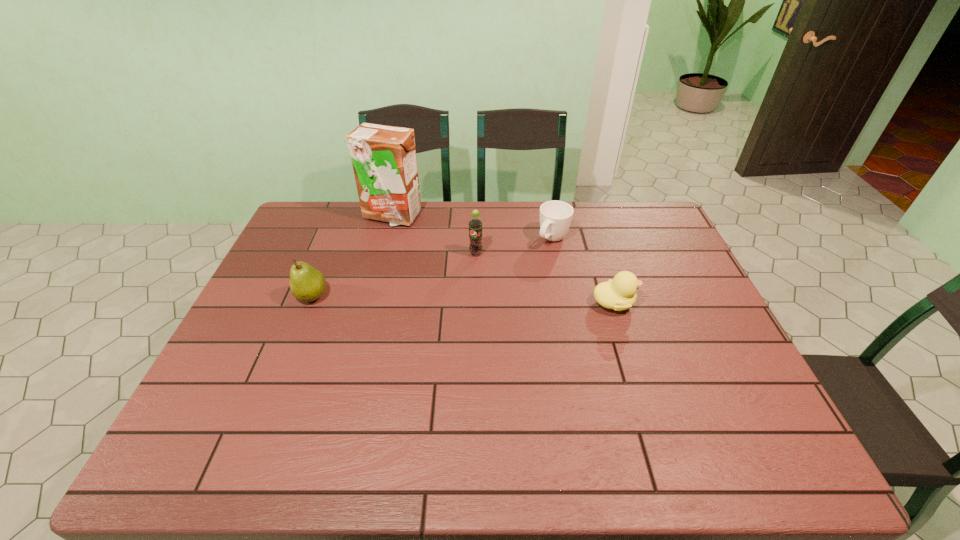
Identify the location of carton that is at the far edge. (383, 157).

Locate an element on the screen. object that is at the left edge is located at coordinates (307, 284).

This screenshot has height=540, width=960. In the image, there is a desktop. Identify the location of free space at the far edge. (464, 221).

The image size is (960, 540). I want to click on vacant region at the near edge of the desktop, so click(575, 418).

Locate an element on the screen. This screenshot has height=540, width=960. vacant space at the left edge is located at coordinates (240, 333).

Locate an element on the screen. This screenshot has height=540, width=960. vacant space at the far left corner of the desktop is located at coordinates (313, 207).

Find the location of `free space at the far right corner of the desktop`. free space at the far right corner of the desktop is located at coordinates (654, 205).

This screenshot has width=960, height=540. I want to click on blank region between the carton and the soda, so click(434, 235).

Find the location of `empty space that is in between the soda and the duckling`. empty space that is in between the soda and the duckling is located at coordinates (545, 279).

What are the coordinates of `vacant space that's between the rightmost object and the second tallest object` in the screenshot? It's located at [x=545, y=279].